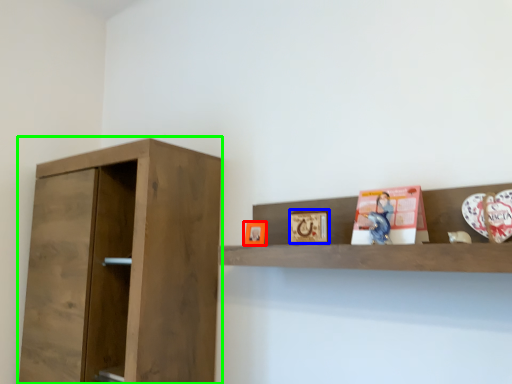
Question: Considering the real-world distances, which object is closest to picture frame (highlighted by a red box)? picture frame (highlighted by a blue box) or cupboard (highlighted by a green box).

Choices:
 (A) picture frame
 (B) cupboard

Answer: (A)